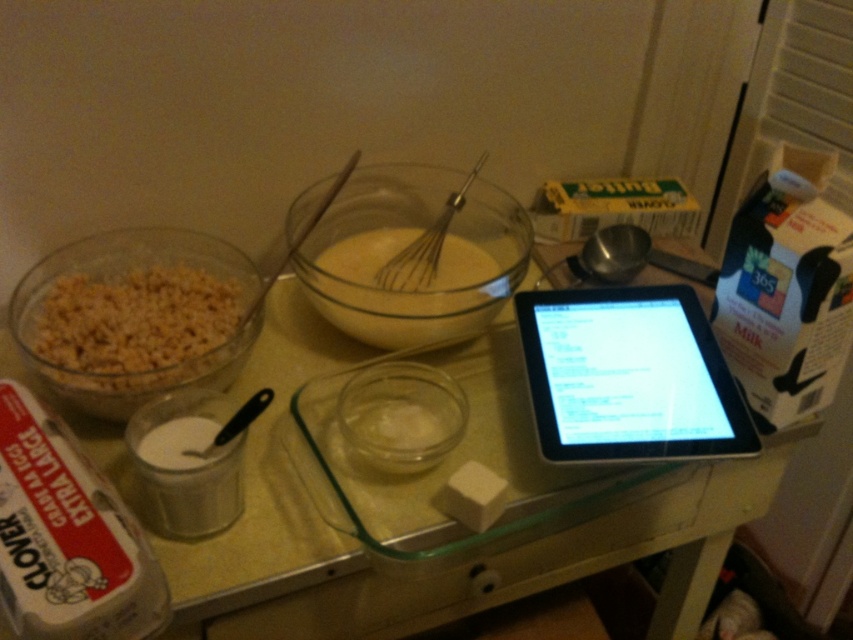
Question: Does black glossy tablet at upper right lie in front of brown crunchy cereal at left?

Choices:
 (A) no
 (B) yes

Answer: (A)

Question: Where is transparent glass bowl at center located in relation to metallic whisk at center in the image?

Choices:
 (A) below
 (B) above

Answer: (A)

Question: Which of the following is the farthest from the observer?

Choices:
 (A) metallic whisk at center
 (B) translucent glass tray at center

Answer: (A)

Question: Among these objects, which one is farthest from the camera?

Choices:
 (A) black glossy tablet at upper right
 (B) metallic whisk at center

Answer: (B)

Question: Considering the real-world distances, which object is closest to the metallic whisk at center?

Choices:
 (A) brown crunchy cereal at left
 (B) translucent glass tray at center
 (C) black glossy tablet at upper right

Answer: (C)

Question: Can you confirm if black glossy tablet at upper right is positioned to the left of transparent glass bowl at center?

Choices:
 (A) no
 (B) yes

Answer: (A)